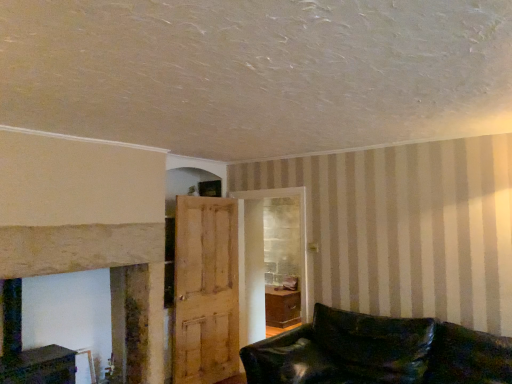
Question: Is smooth stone fireplace at left spatially inside light brown wooden door at center, or outside of it?

Choices:
 (A) inside
 (B) outside

Answer: (B)

Question: From the image's perspective, is smooth stone fireplace at left located above or below light brown wooden door at center?

Choices:
 (A) below
 (B) above

Answer: (B)

Question: Which is nearer to the light brown wooden door at center?

Choices:
 (A) leather couch at lower right
 (B) smooth stone fireplace at left

Answer: (B)

Question: Which is nearer to the smooth stone fireplace at left?

Choices:
 (A) leather couch at lower right
 (B) light brown wooden door at center

Answer: (B)